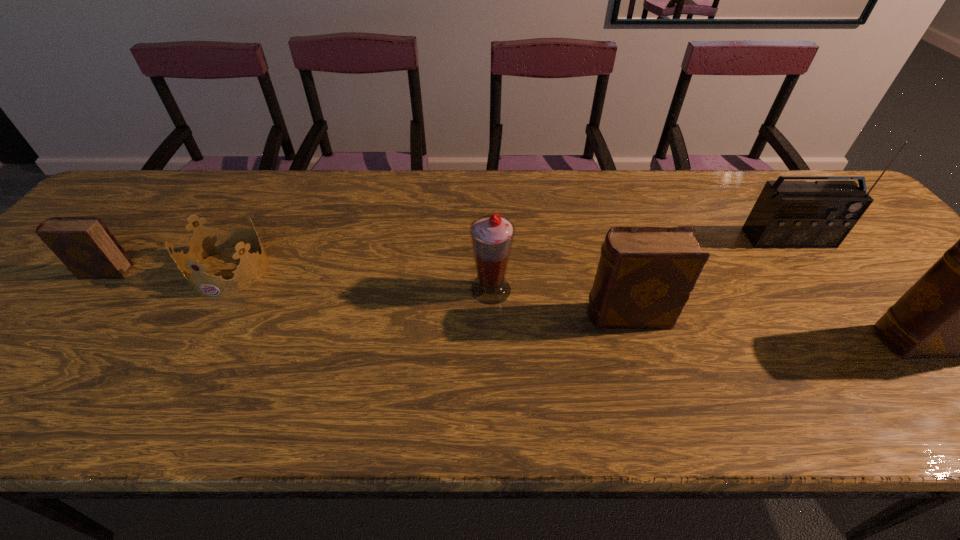
At what (x,y) coordinates should I click in order to perform the action: click on diary that can be found as the second closest to the fourth object from left to right. Please return your answer as a coordinate pair (x, y). Looking at the image, I should click on (87, 248).

Select which diary appears as the closest to the leftmost object. Please provide its 2D coordinates. Your answer should be formatted as a tuple, i.e. [(x, y)], where the tuple contains the x and y coordinates of a point satisfying the conditions above.

[(645, 275)]

Locate an element on the screen. blank space that satisfies the following two spatial constraints: 1. on the front panel of the tallest object; 2. on the spine side of the fifth tallest object is located at coordinates (813, 272).

Image resolution: width=960 pixels, height=540 pixels. I want to click on free point that satisfies the following two spatial constraints: 1. on the front-facing side of the fifth object from right to left; 2. on the right side of the fourth object from right to left, so click(x=219, y=289).

The height and width of the screenshot is (540, 960). In order to click on blank space that satisfies the following two spatial constraints: 1. on the front panel of the tallest object; 2. on the spine side of the fifth tallest object in this screenshot , I will do `click(813, 272)`.

Locate an element on the screen. The image size is (960, 540). free spot that satisfies the following two spatial constraints: 1. on the front panel of the radio receiver; 2. on the spine side of the leftmost object is located at coordinates (813, 272).